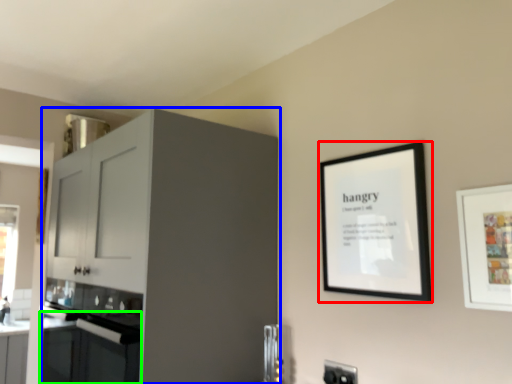
Question: Based on their relative distances, which object is farther from picture frame (highlighted by a red box)? Choose from cabinetry (highlighted by a blue box) and oven (highlighted by a green box).

Choices:
 (A) cabinetry
 (B) oven

Answer: (B)